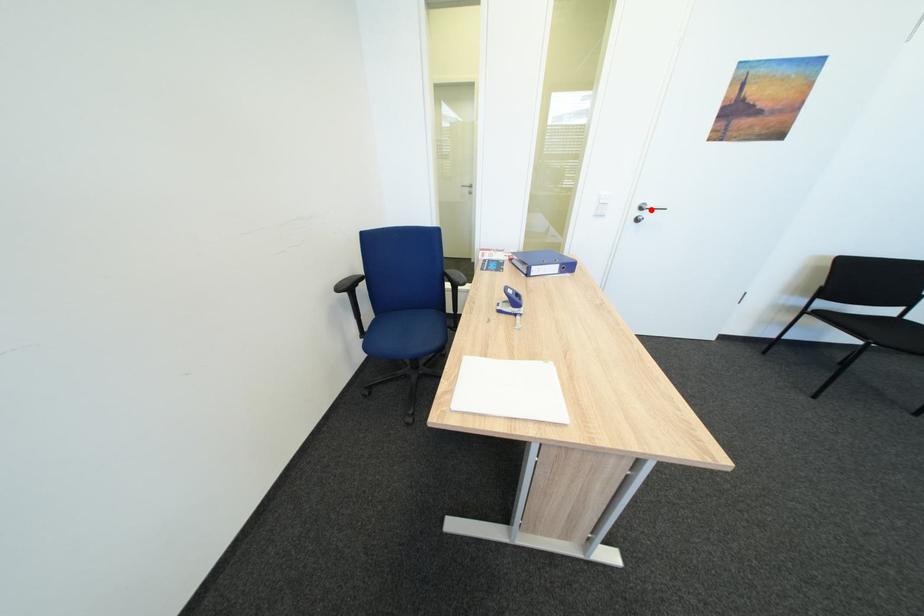
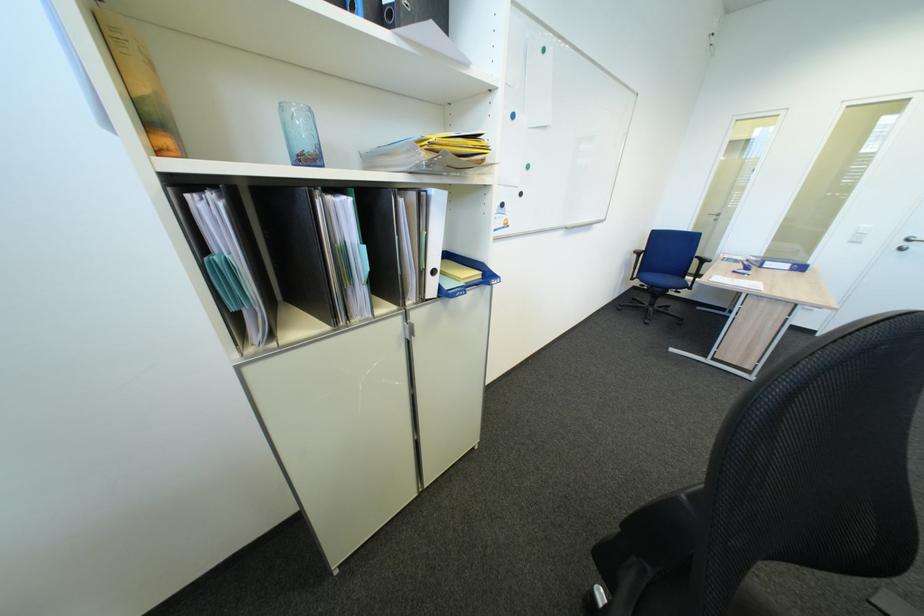
Question: A red point is marked in image1. In image2, is the corresponding 3D point closer to the camera or farther? Reply with the corresponding letter.

Choices:
 (A) The corresponding 3D point is closer.
 (B) The corresponding 3D point is farther.

Answer: (B)